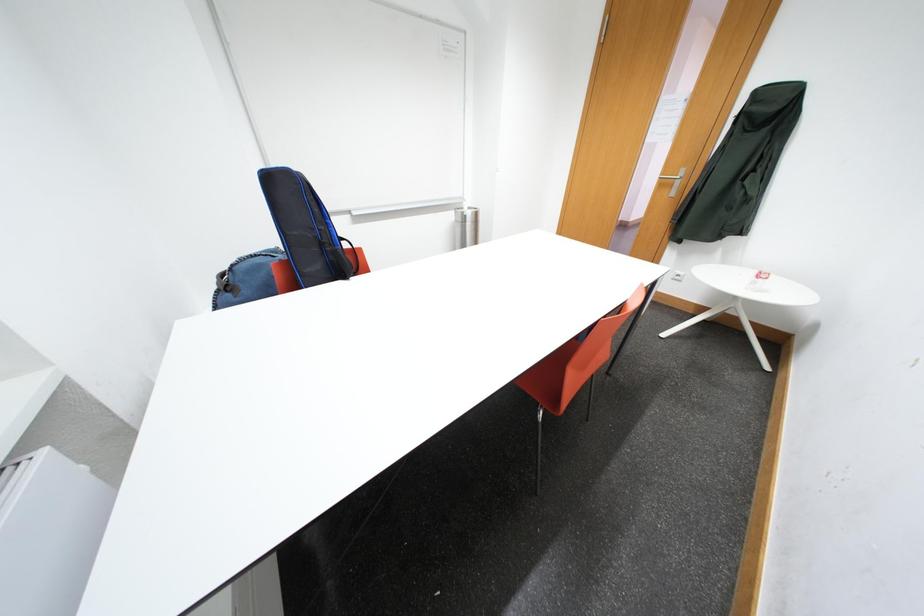
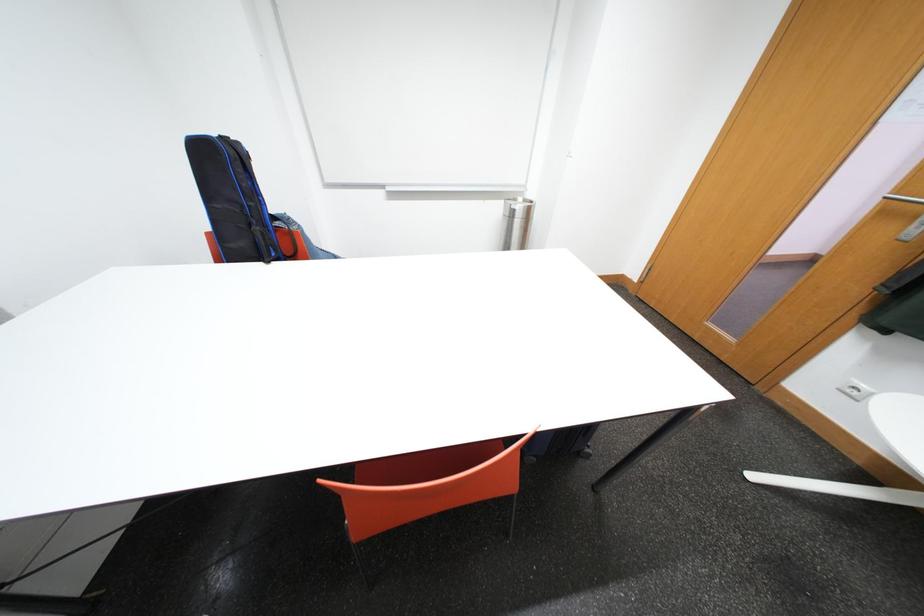
In a continuous first-person perspective shot, in which direction is the camera moving?

The cameraman walked toward right, forward.